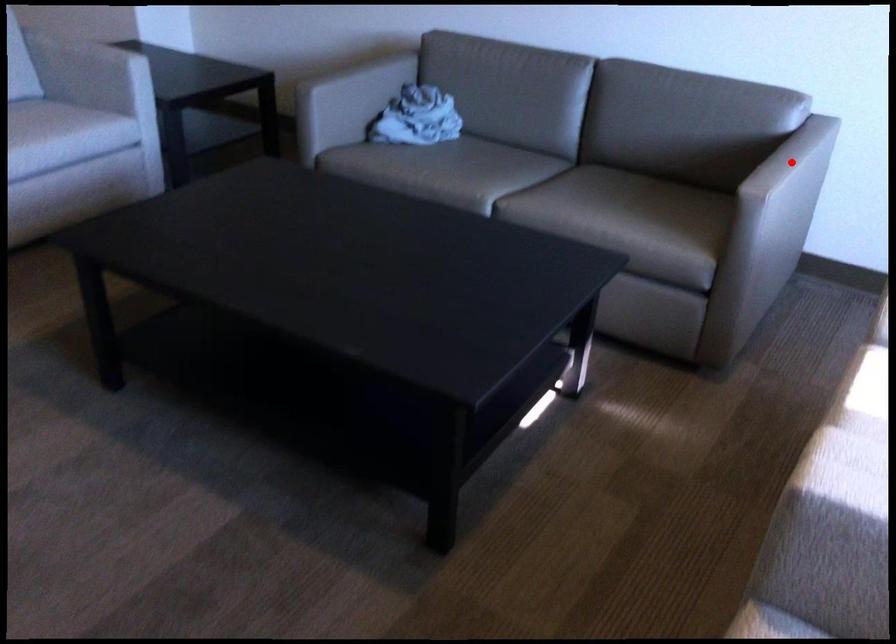
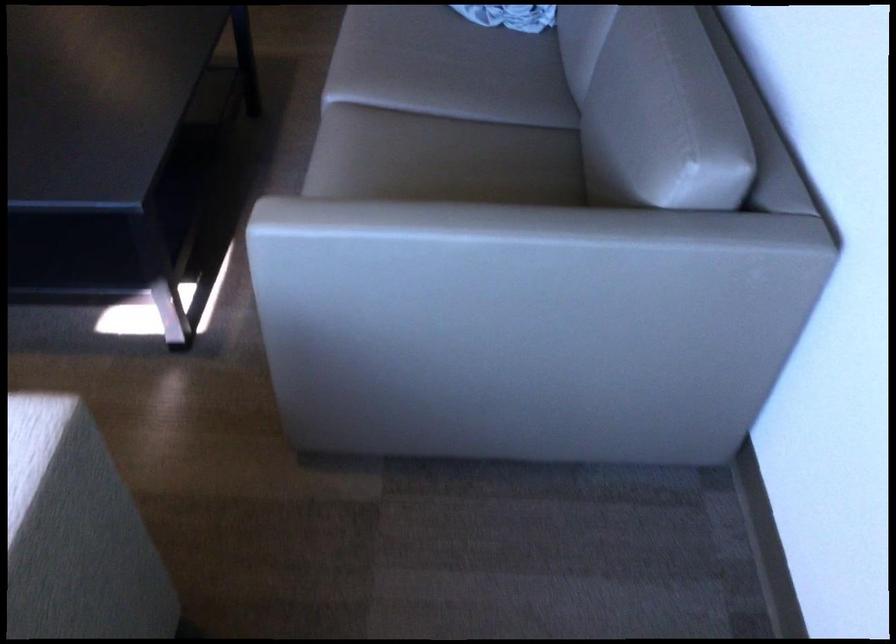
Question: I am providing you with two images of the same scene from different viewpoints. In image1, a red point is highlighted. Considering the same 3D point in image2, which of the following is correct?

Choices:
 (A) It is closer
 (B) It is farther

Answer: (A)